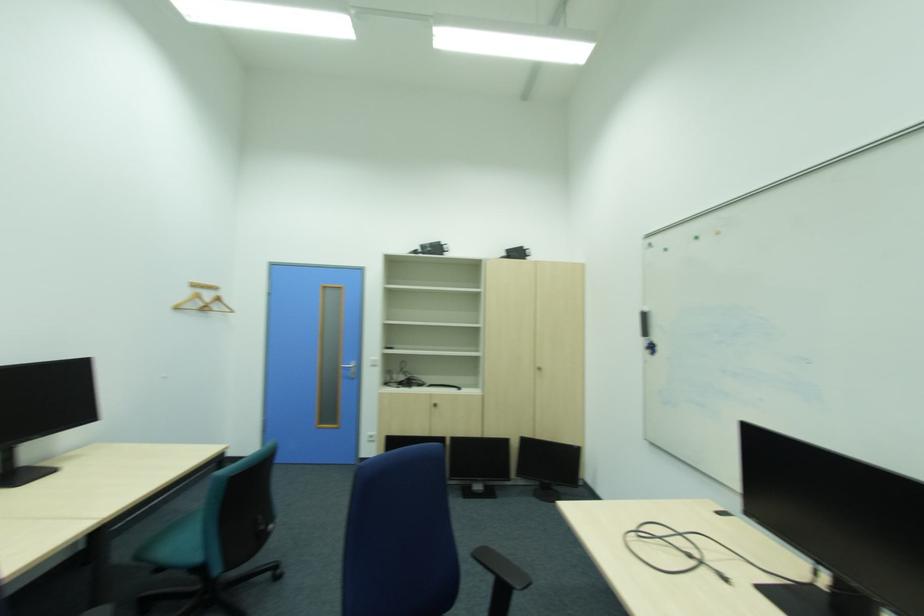
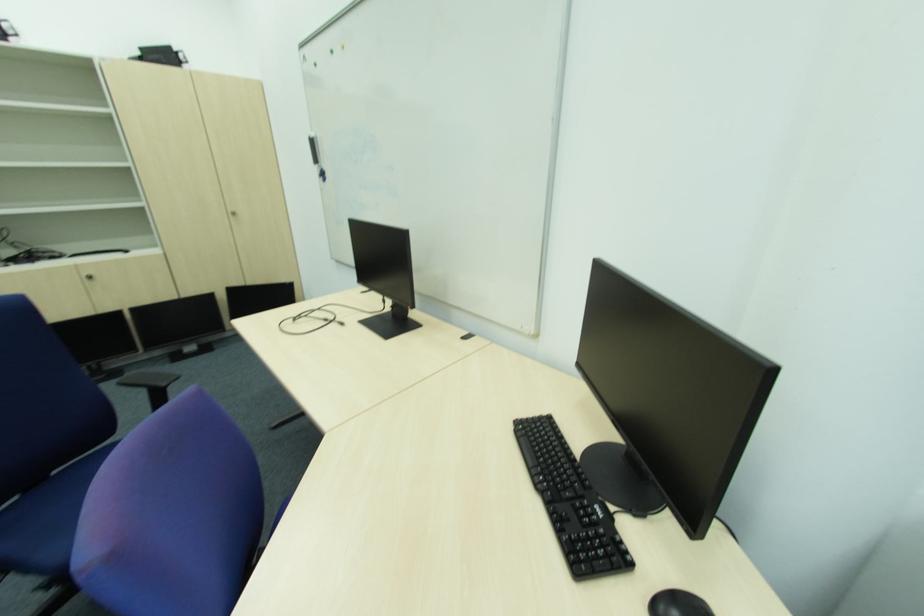
Based on the continuous images, in which direction is the camera rotating?

The rotation direction of the camera is right-down.